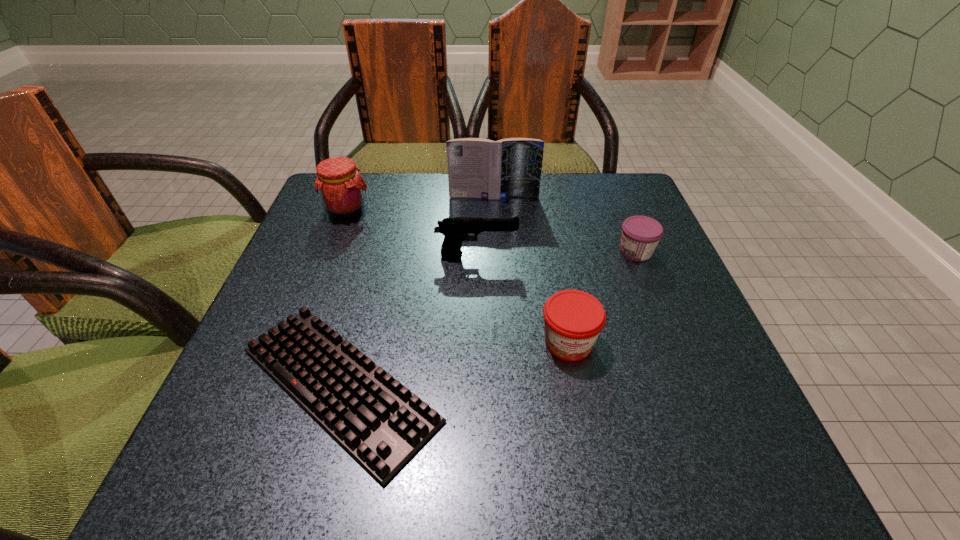
Image resolution: width=960 pixels, height=540 pixels. Identify the location of unoccupied position between the shortest object and the fifth tallest object. (488, 318).

Identify the location of object that is the closest one to the rightmost jam. This screenshot has height=540, width=960. (573, 319).

You are a GUI agent. You are given a task and a screenshot of the screen. Output one action in this format:
    pyautogui.click(x=<x>, y=<y>)
    Task: Click on the object that is the third closest to the fifth tallest object
    
    Given the screenshot: What is the action you would take?
    pyautogui.click(x=479, y=168)

Where is `jam that is the closest to the computer keyboard`? This screenshot has height=540, width=960. jam that is the closest to the computer keyboard is located at coordinates (573, 319).

Choose which jam is the nearest neighbor to the shortest object. Please provide its 2D coordinates. Your answer should be formatted as a tuple, i.e. [(x, y)], where the tuple contains the x and y coordinates of a point satisfying the conditions above.

[(573, 319)]

You are a GUI agent. You are given a task and a screenshot of the screen. Output one action in this format:
    pyautogui.click(x=<x>, y=<y>)
    Task: Click on the free spot that satisfies the following two spatial constraints: 1. on the front label of the fifth tallest object; 2. on the label side of the third shortest object
    The image size is (960, 540).
    Given the screenshot: What is the action you would take?
    [672, 342]

Find the location of a particular element. Image resolution: width=960 pixels, height=540 pixels. vacant region that satisfies the following two spatial constraints: 1. on the front cover of the book; 2. on the front-facing side of the pistol is located at coordinates (496, 254).

This screenshot has height=540, width=960. Find the location of `blank space that satisfies the following two spatial constraints: 1. on the front cover of the tallest object; 2. on the front-facing side of the pistol`. blank space that satisfies the following two spatial constraints: 1. on the front cover of the tallest object; 2. on the front-facing side of the pistol is located at coordinates (496, 254).